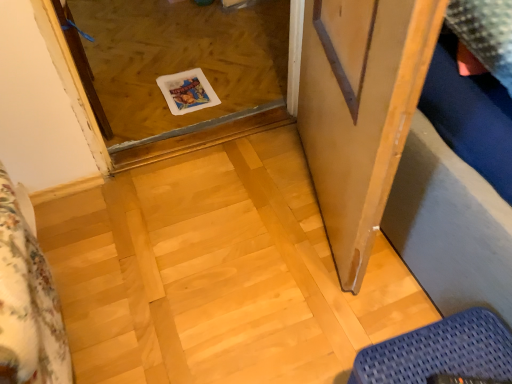
The width and height of the screenshot is (512, 384). Describe the element at coordinates (181, 71) in the screenshot. I see `transparent glass door at center` at that location.

The image size is (512, 384). In order to click on transparent glass door at center in this screenshot , I will do `click(181, 71)`.

Is blue woven mat at lower right not inside transparent glass door at center?

Yes, blue woven mat at lower right is not within transparent glass door at center.

Measure the distance between blue woven mat at lower right and transparent glass door at center.

blue woven mat at lower right is 4.73 feet from transparent glass door at center.

From a real-world perspective, which is physically below, blue woven mat at lower right or transparent glass door at center?

In real-world perspective, transparent glass door at center is lower.

Considering the sizes of objects blue woven mat at lower right and transparent glass door at center in the image provided, who is bigger, blue woven mat at lower right or transparent glass door at center?

With larger size is transparent glass door at center.

Which of these two, wooden screen door at right or transparent glass door at center, is smaller?

transparent glass door at center.

Which is farther from the camera, (x=409, y=33) or (x=117, y=17)?

Point (x=117, y=17)

Looking at this image, is wooden screen door at right positioned behind transparent glass door at center?

No, wooden screen door at right is closer to the viewer.

Between wooden screen door at right and transparent glass door at center, which one has more height?

wooden screen door at right is taller.

Which is behind, point (272, 19) or point (411, 366)?

Point (272, 19)

Could you tell me if transparent glass door at center is turned towards blue woven mat at lower right?

No, transparent glass door at center does not turn towards blue woven mat at lower right.

From the picture: Between transparent glass door at center and blue woven mat at lower right, which one has larger size?

transparent glass door at center is bigger.

Is transparent glass door at center smaller than wooden screen door at right?

Indeed, transparent glass door at center has a smaller size compared to wooden screen door at right.

Does transparent glass door at center come in front of wooden screen door at right?

No.

Is transparent glass door at center completely or partially outside of wooden screen door at right?

Yes, transparent glass door at center is located beyond the bounds of wooden screen door at right.

Considering the sizes of wooden screen door at right and blue woven mat at lower right in the image, is wooden screen door at right taller or shorter than blue woven mat at lower right?

Clearly, wooden screen door at right is taller compared to blue woven mat at lower right.

Locate an element on the screen. The width and height of the screenshot is (512, 384). screen door to the left of blue woven mat at lower right is located at coordinates (353, 116).

In terms of size, does wooden screen door at right appear bigger or smaller than blue woven mat at lower right?

wooden screen door at right is bigger than blue woven mat at lower right.

From a real-world perspective, is wooden screen door at right positioned above or below blue woven mat at lower right?

wooden screen door at right is situated higher than blue woven mat at lower right in the real world.

Is blue woven mat at lower right next to wooden screen door at right?

No, blue woven mat at lower right is not with wooden screen door at right.

Visually, is blue woven mat at lower right positioned to the left or to the right of wooden screen door at right?

In the image, blue woven mat at lower right appears on the right side of wooden screen door at right.

Which is correct: blue woven mat at lower right is inside wooden screen door at right, or outside of it?

blue woven mat at lower right lies outside wooden screen door at right.

The height and width of the screenshot is (384, 512). I want to click on glass door behind the blue woven mat at lower right, so click(181, 71).

This screenshot has height=384, width=512. I want to click on screen door lying below the transparent glass door at center (from the image's perspective), so click(x=353, y=116).

From the image, which object appears to be nearer to wooden screen door at right, blue woven mat at lower right or transparent glass door at center?

blue woven mat at lower right is closer to wooden screen door at right.

Which object lies nearer to the anchor point transparent glass door at center, blue woven mat at lower right or wooden screen door at right?

wooden screen door at right.

Which object lies further to the anchor point blue woven mat at lower right, transparent glass door at center or wooden screen door at right?

transparent glass door at center.

From the image, which object appears to be nearer to wooden screen door at right, transparent glass door at center or blue woven mat at lower right?

Among the two, blue woven mat at lower right is located nearer to wooden screen door at right.

Estimate the real-world distances between objects in this image. Which object is further from transparent glass door at center, wooden screen door at right or blue woven mat at lower right?

blue woven mat at lower right is positioned further to the anchor transparent glass door at center.

Based on their spatial positions, is wooden screen door at right or transparent glass door at center further from blue woven mat at lower right?

The object further to blue woven mat at lower right is transparent glass door at center.

Locate an element on the screen. The image size is (512, 384). screen door between transparent glass door at center and blue woven mat at lower right from top to bottom is located at coordinates (353, 116).